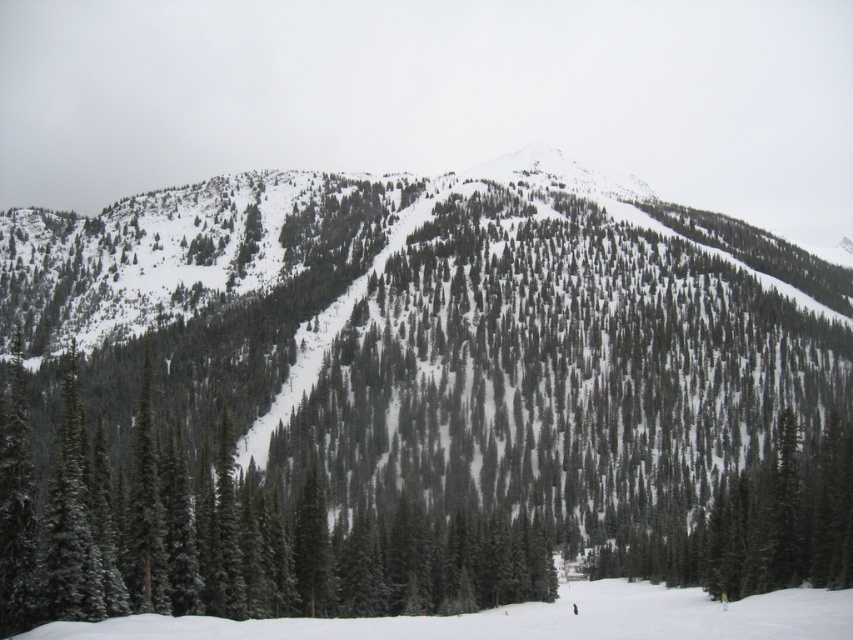
You are a skier planning to navigate the snowy mountain slope. You see a point marked at coordinates (410,400). What object is located at that point?

The point at coordinates (410,400) indicates a green textured pine at center.

Looking at this image, you are a photographer trying to capture a clear image of the green textured pine at center and the green textured pine tree at center. Which one should you focus on first if you want to ensure both are in focus?

The green textured pine at center is larger in size than the green textured pine tree at center, so focusing on the larger one first would help ensure both are in focus.

You are a skier planning to descend the mountain slope. You see two points marked on your map. The first point is at coordinate point [651,220] and the second is at point [0,397]. If you want to reach the point that is closer to the base of the mountain, which coordinate should you aim for?

The point at [0,397] is closer to the base of the mountain because it is positioned lower on the slope compared to point [651,220], which is further up the slope.